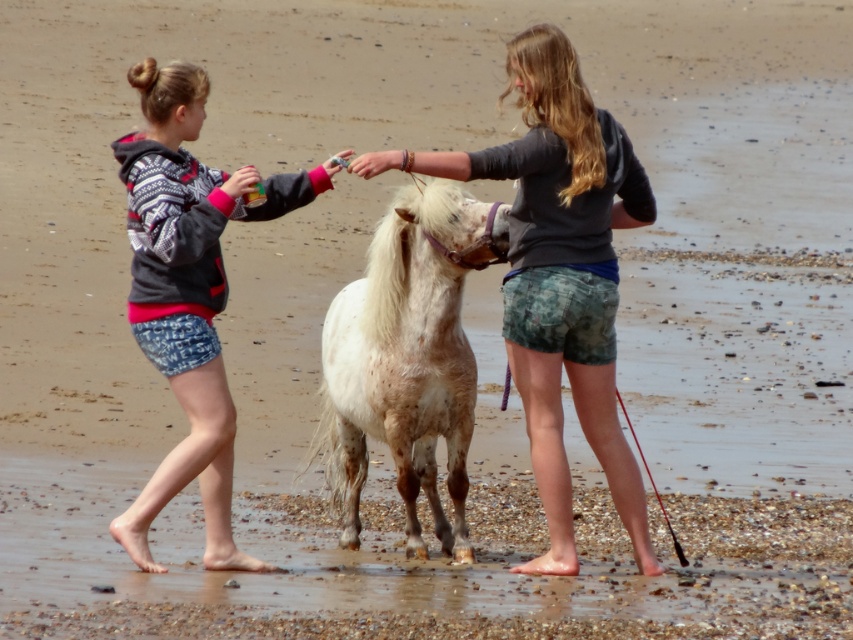
Between spotted white pony at center and white speckled fur at center, which one appears on the right side from the viewer's perspective?

From the viewer's perspective, spotted white pony at center appears more on the right side.

Who is higher up, spotted white pony at center or white speckled fur at center?

spotted white pony at center

The image size is (853, 640). In order to click on spotted white pony at center in this screenshot , I will do `click(560, 273)`.

The image size is (853, 640). I want to click on spotted white pony at center, so 560,273.

Does spotted white pony at center come behind patterned denim shorts at left?

No, it is in front of patterned denim shorts at left.

Which is more to the right, spotted white pony at center or patterned denim shorts at left?

spotted white pony at center

Where is `spotted white pony at center`? spotted white pony at center is located at coordinates (560, 273).

Between point (457, 525) and point (178, 392), which one is positioned behind?

Positioned behind is point (457, 525).

This screenshot has width=853, height=640. What do you see at coordinates (405, 358) in the screenshot? I see `white speckled fur at center` at bounding box center [405, 358].

Describe the element at coordinates (405, 358) in the screenshot. This screenshot has height=640, width=853. I see `white speckled fur at center` at that location.

The height and width of the screenshot is (640, 853). Identify the location of white speckled fur at center. (405, 358).